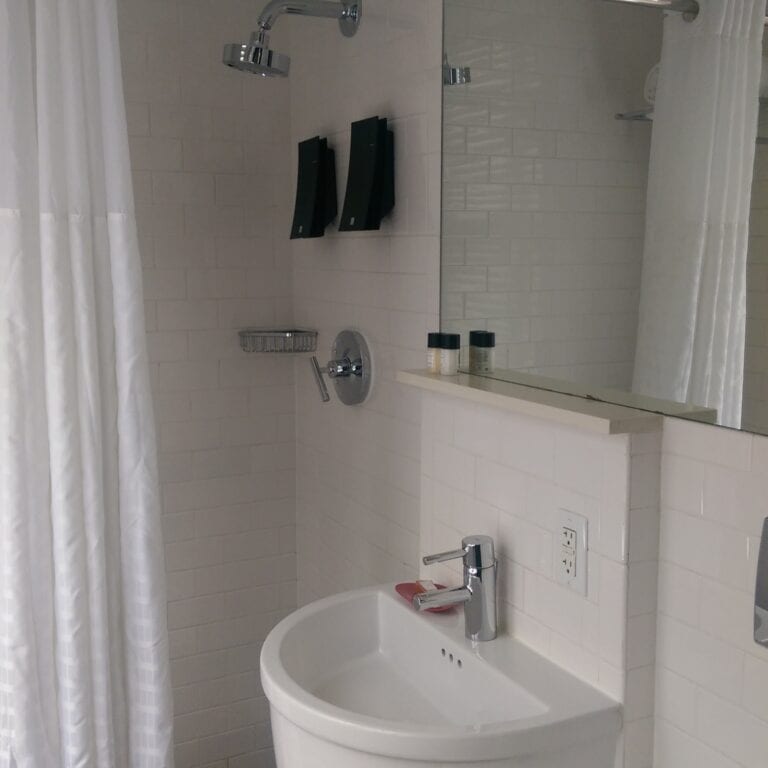
You are a GUI agent. You are given a task and a screenshot of the screen. Output one action in this format:
    pyautogui.click(x=<x>, y=<y>)
    Task: Click on the white sink
    The height and width of the screenshot is (768, 768).
    Given the screenshot: What is the action you would take?
    pyautogui.click(x=405, y=697)